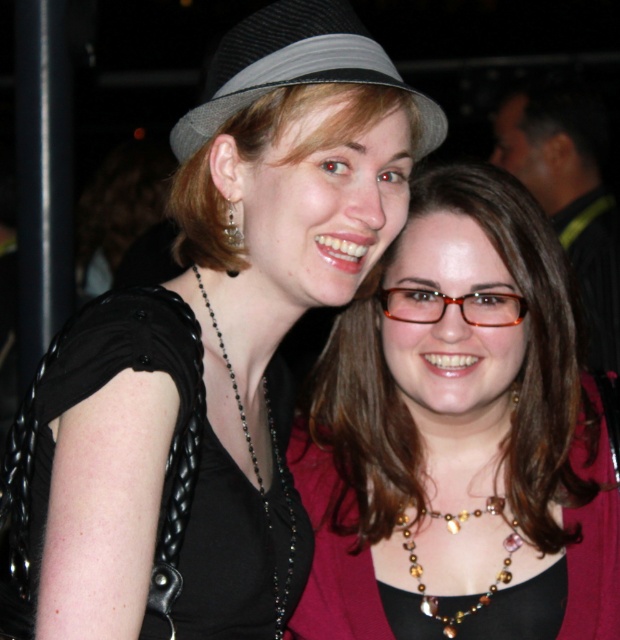
Who is higher up, matte black hat at upper center or gray felt fedora at upper center?

gray felt fedora at upper center

Which is more to the right, matte black hat at upper center or gray felt fedora at upper center?

gray felt fedora at upper center

Who is more distant from viewer, (361, 202) or (260, 38)?

The point (361, 202) is behind.

This screenshot has width=620, height=640. Find the location of `matte black hat at upper center`. matte black hat at upper center is located at coordinates (218, 339).

Based on the photo, is matte black hat at upper center further to camera compared to multicolored beaded necklace at center?

No, it is not.

Between matte black hat at upper center and multicolored beaded necklace at center, which one is positioned higher?

matte black hat at upper center is higher up.

Where is `matte black hat at upper center`? This screenshot has width=620, height=640. matte black hat at upper center is located at coordinates coord(218,339).

Locate an element on the screen. The image size is (620, 640). matte black hat at upper center is located at coordinates (218, 339).

Is matte black necklace at center shorter than black braided fabric dress at left?

Incorrect, matte black necklace at center's height does not fall short of black braided fabric dress at left's.

Who is higher up, matte black necklace at center or black braided fabric dress at left?

matte black necklace at center is above.

Find the location of a particular element. The height and width of the screenshot is (640, 620). matte black necklace at center is located at coordinates 459,436.

Find the location of `matte black necklace at center`. matte black necklace at center is located at coordinates (459, 436).